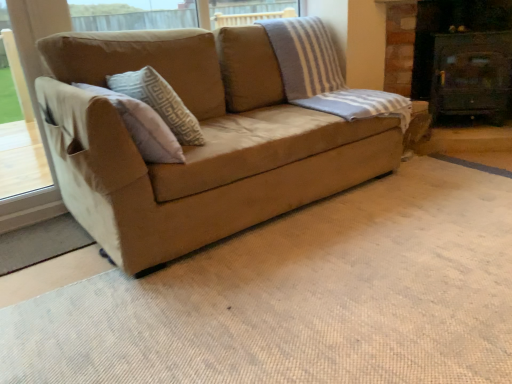
Identify the location of dark wood fireplace at right. The image size is (512, 384). (464, 57).

Describe the element at coordinates (464, 57) in the screenshot. I see `dark wood fireplace at right` at that location.

Where is `dark wood fireplace at right`? The image size is (512, 384). dark wood fireplace at right is located at coordinates (464, 57).